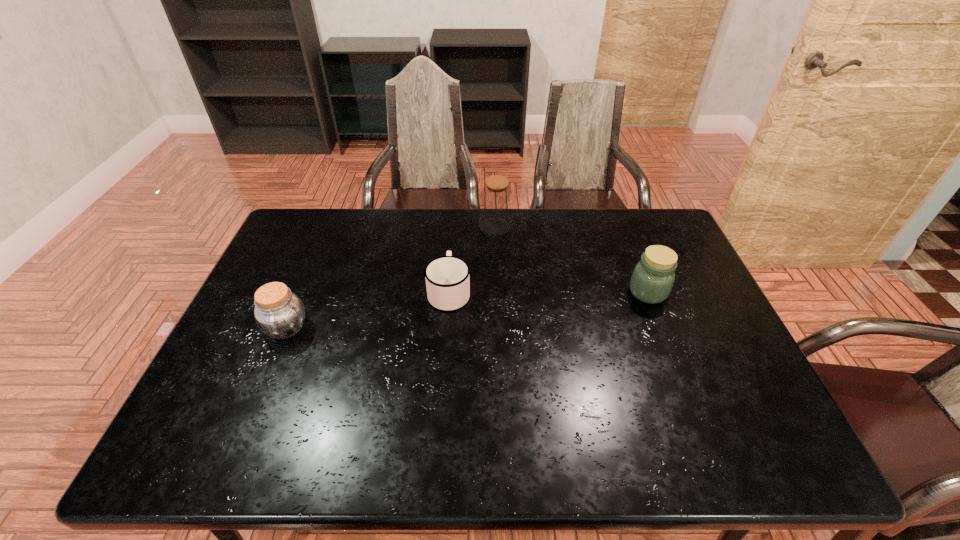
This screenshot has height=540, width=960. Identify the location of vacant area located 0.080m on the front of the leftmost object. (268, 372).

Where is `free space located on the side of the second object from left to right with the handle`? This screenshot has height=540, width=960. free space located on the side of the second object from left to right with the handle is located at coordinates (453, 240).

Identify the location of blank space located 0.120m on the side of the second object from left to right with the handle. (452, 248).

You are a GUI agent. You are given a task and a screenshot of the screen. Output one action in this format:
    pyautogui.click(x=<x>, y=<y>)
    Task: Click on the vacant space located 0.050m on the side of the second object from left to right with the handle
    
    Given the screenshot: What is the action you would take?
    pyautogui.click(x=451, y=262)

In order to click on object that is at the far edge in this screenshot , I will do `click(496, 199)`.

The width and height of the screenshot is (960, 540). What are the coordinates of `object positioned at the left edge` in the screenshot? It's located at (279, 313).

The height and width of the screenshot is (540, 960). I want to click on object that is at the right edge, so click(653, 277).

Locate an element on the screen. vacant space at the far edge is located at coordinates (538, 224).

Locate an element on the screen. The height and width of the screenshot is (540, 960). vacant space at the near edge is located at coordinates (657, 457).

At what (x,y) coordinates should I click in order to perform the action: click on vacant space at the left edge of the desktop. Please return your answer as a coordinate pair (x, y). The height and width of the screenshot is (540, 960). Looking at the image, I should click on (273, 366).